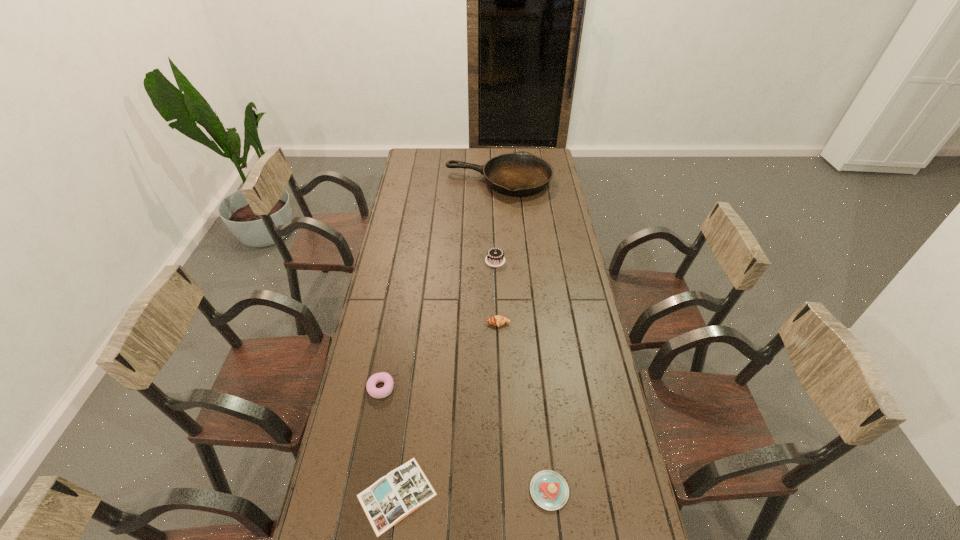
Image resolution: width=960 pixels, height=540 pixels. Find the location of `free space at the left edge of the desktop`. free space at the left edge of the desktop is located at coordinates (357, 383).

At what (x,y) coordinates should I click in order to perform the action: click on free spot at the right edge of the desktop. Please return your answer as a coordinate pair (x, y). Looking at the image, I should click on (619, 469).

This screenshot has width=960, height=540. What are the coordinates of `vacant space at the far right corner` in the screenshot? It's located at (529, 150).

You are a GUI agent. You are given a task and a screenshot of the screen. Output one action in this format:
    pyautogui.click(x=<x>, y=<y>)
    Task: Click on the vacant space in between the second farthest object and the farthest pastry
    This screenshot has height=540, width=960.
    Given the screenshot: What is the action you would take?
    pyautogui.click(x=496, y=292)

Identify the location of vacant space that's between the nearest pastry and the shortest object. [473, 493].

This screenshot has width=960, height=540. Find the location of `free space between the farthest pastry and the chocolate cake`. free space between the farthest pastry and the chocolate cake is located at coordinates (496, 292).

At what (x,y) coordinates should I click in order to perform the action: click on free space between the chocolate cake and the farthest pastry. Please return your answer as a coordinate pair (x, y). Looking at the image, I should click on (496, 292).

Find the location of a particular element. vacant point located between the book and the chocolate cake is located at coordinates (446, 377).

Locate an element on the screen. The width and height of the screenshot is (960, 540). vacant space that is in between the nearest pastry and the frying pan is located at coordinates (524, 336).

Where is `free area in between the second pastry from right to left and the book`? free area in between the second pastry from right to left and the book is located at coordinates (447, 409).